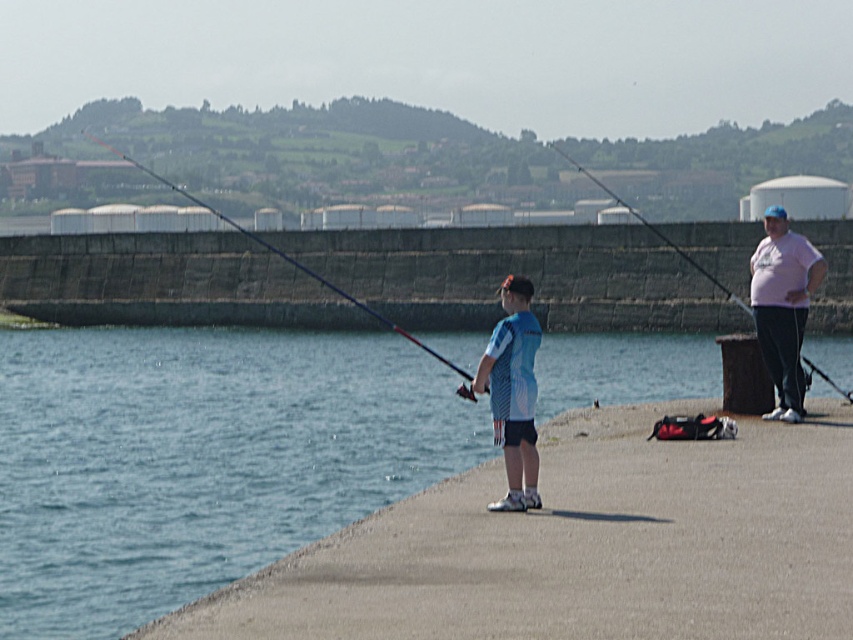
You are a photographer trying to capture a candid shot of both the blue matte shirt at center and the pink cotton shirt at center. Since you want to frame them in a way that shows their positions relative to each other, which one should you place on the left side of your photo?

The blue matte shirt at center is positioned on the left side of the pink cotton shirt at center, so you should place the blue matte shirt at center on the left side of your photo to accurately represent their positions.